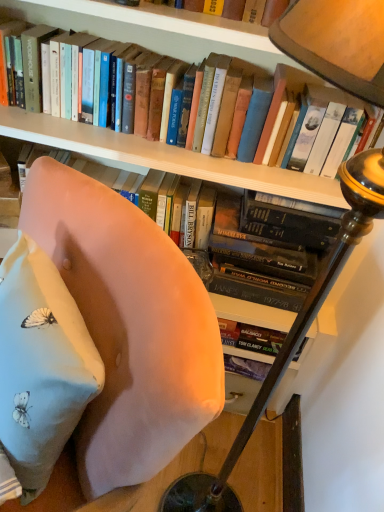
Question: Is light pink fabric pillow at lower left at the right side of wooden table lamp at upper right?

Choices:
 (A) no
 (B) yes

Answer: (A)

Question: Are light pink fabric pillow at lower left and wooden table lamp at upper right beside each other?

Choices:
 (A) no
 (B) yes

Answer: (A)

Question: From a real-world perspective, is light pink fabric pillow at lower left located beneath wooden table lamp at upper right?

Choices:
 (A) no
 (B) yes

Answer: (A)

Question: Is light pink fabric pillow at lower left outside of wooden table lamp at upper right?

Choices:
 (A) yes
 (B) no

Answer: (A)

Question: Is light pink fabric pillow at lower left to the left of wooden table lamp at upper right from the viewer's perspective?

Choices:
 (A) yes
 (B) no

Answer: (A)

Question: From a real-world perspective, relative to pink fabric chair at center, is hardcover book at upper center vertically above or below?

Choices:
 (A) below
 (B) above

Answer: (B)

Question: Is hardcover book at upper center situated inside pink fabric chair at center or outside?

Choices:
 (A) inside
 (B) outside

Answer: (B)

Question: Is point (274, 47) positioned closer to the camera than point (208, 417)?

Choices:
 (A) farther
 (B) closer

Answer: (A)

Question: From their relative heights in the image, would you say hardcover book at upper center is taller or shorter than pink fabric chair at center?

Choices:
 (A) short
 (B) tall

Answer: (A)

Question: From the image's perspective, is wooden table lamp at upper right above or below hardcover book at upper center?

Choices:
 (A) below
 (B) above

Answer: (A)

Question: Considering the positions of wooden table lamp at upper right and hardcover book at upper center in the image, is wooden table lamp at upper right taller or shorter than hardcover book at upper center?

Choices:
 (A) tall
 (B) short

Answer: (A)

Question: Is wooden table lamp at upper right bigger or smaller than hardcover book at upper center?

Choices:
 (A) small
 (B) big

Answer: (B)

Question: From a real-world perspective, is wooden table lamp at upper right positioned above or below hardcover book at upper center?

Choices:
 (A) below
 (B) above

Answer: (A)

Question: In the image, is pink fabric chair at center on the left side or the right side of light pink fabric pillow at lower left?

Choices:
 (A) left
 (B) right

Answer: (B)

Question: Looking at their shapes, would you say pink fabric chair at center is wider or thinner than light pink fabric pillow at lower left?

Choices:
 (A) wide
 (B) thin

Answer: (A)